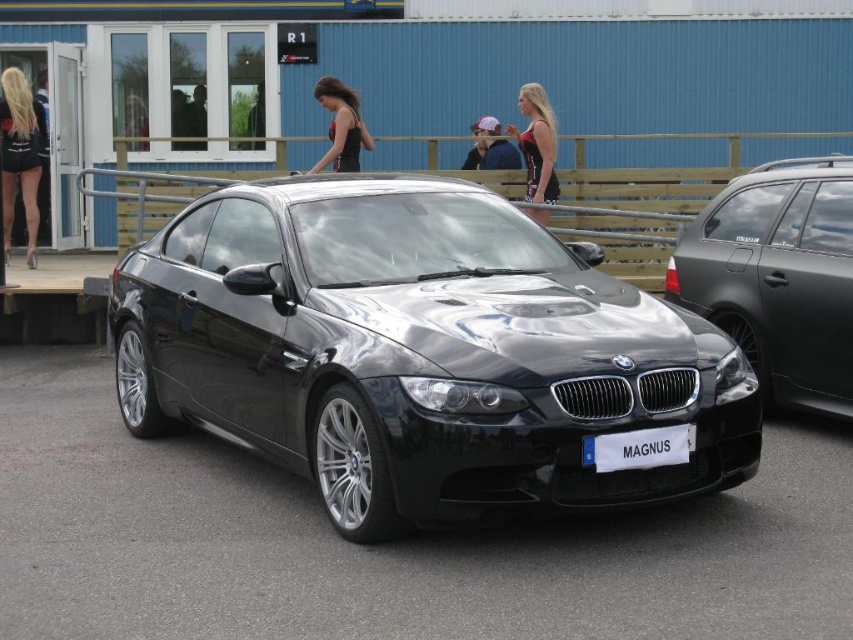
Does point (524, 147) lie behind point (354, 96)?

Yes, point (524, 147) is behind point (354, 96).

Is point (521, 109) closer to camera compared to point (346, 115)?

No, (521, 109) is behind (346, 115).

Measure the distance between black mesh tank top at center and camera.

They are 9.63 meters apart.

Locate an element on the screen. black mesh tank top at center is located at coordinates (537, 144).

Based on the photo, does shiny black car at center have a smaller size compared to blonde hair at left?

No, shiny black car at center is not smaller than blonde hair at left.

Who is more distant from viewer, (517,438) or (22,140)?

Positioned behind is point (22,140).

Between point (393, 237) and point (18, 145), which one is positioned behind?

Point (18, 145)

Where is `shiny black car at center`? shiny black car at center is located at coordinates (416, 352).

From the picture: Who is shorter, shiny black car at center or black mesh tank top at center?

With less height is black mesh tank top at center.

What do you see at coordinates (416, 352) in the screenshot? The height and width of the screenshot is (640, 853). I see `shiny black car at center` at bounding box center [416, 352].

What are the coordinates of `shiny black car at center` in the screenshot? It's located at (416, 352).